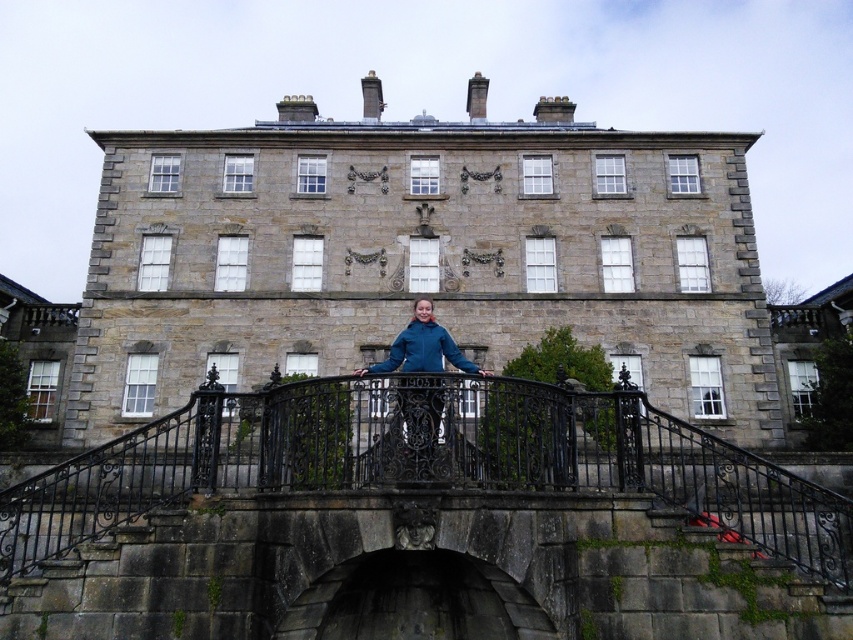
You are standing in front of the grand stone building and want to reach a specific point marked at coordinates point (x=480, y=412). If you can walk 100 feet in 2 minutes, how long will it take you to reach that point?

The distance of point (x=480, y=412) from viewer is 112.83 feet. At a walking speed of 100 feet per 2 minutes, it would take approximately 2 minutes and 26 seconds to reach the point.

You are standing in front of the grand stone building and want to take a photo that includes both the person in the blue jacket and the ornate carvings on the central section. Which of the two points, point (409, 476) or point (430, 332), should you focus on to ensure both subjects are in sharp focus?

You should focus on point (430, 332) because it is farther from the camera than point (409, 476). Since the person in the blue jacket is closer to the camera and the ornate carvings are on the central section of the building which is farther away, focusing on the farther point will help keep both in focus.

You are a tour guide leading a group near the grand stone building. You need to guide a visitor wearing a blue fleece jacket at center to cross the black wrought iron bridge at center. Can the visitor safely walk across the bridge?

The black wrought iron bridge at center is wider than the blue fleece jacket at center, so the visitor can safely walk across the bridge.